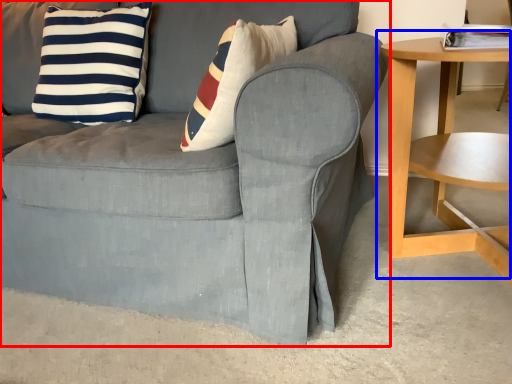
Question: Among these objects, which one is farthest to the camera, chair (highlighted by a red box) or table (highlighted by a blue box)?

Choices:
 (A) chair
 (B) table

Answer: (B)